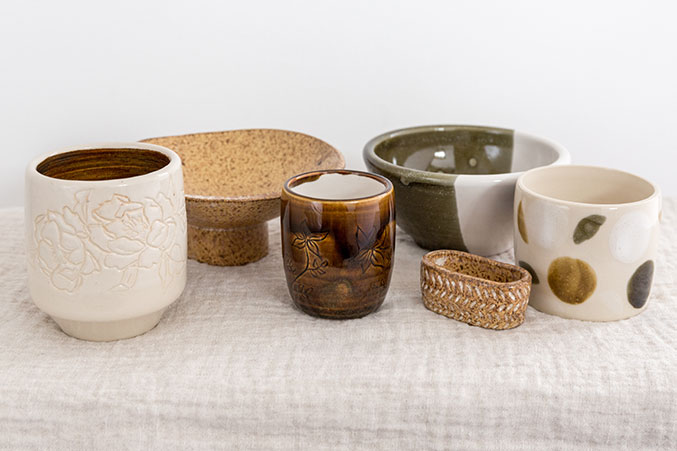
The image size is (677, 451). Find the location of `white cup`. white cup is located at coordinates pyautogui.click(x=607, y=240).